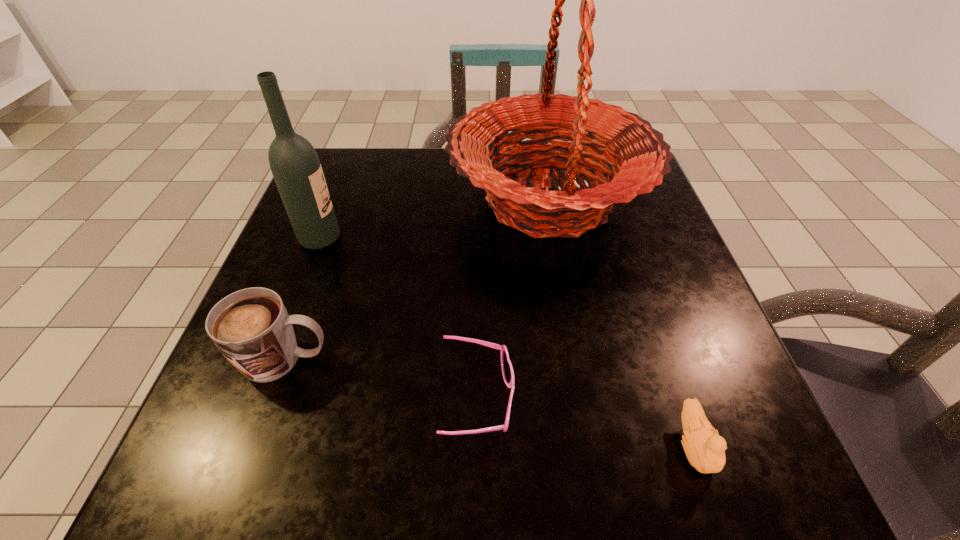
This screenshot has height=540, width=960. I want to click on free space that is in between the wine bottle and the third tallest object, so click(302, 299).

The height and width of the screenshot is (540, 960). In order to click on empty location between the third tallest object and the wine bottle in this screenshot , I will do [302, 299].

This screenshot has height=540, width=960. In order to click on free space that is in between the fourth tallest object and the basket in this screenshot , I will do `click(621, 323)`.

Image resolution: width=960 pixels, height=540 pixels. In order to click on empty space between the tallest object and the third tallest object in this screenshot , I will do `click(417, 280)`.

Find the location of a particular element. Image resolution: width=960 pixels, height=540 pixels. free space between the basket and the sunglasses is located at coordinates (513, 300).

Identify the location of object that can be found as the second closest to the shortest object. This screenshot has height=540, width=960. (642, 159).

Where is `object identified as the fourth closest to the wine bottle`? Image resolution: width=960 pixels, height=540 pixels. object identified as the fourth closest to the wine bottle is located at coordinates (705, 450).